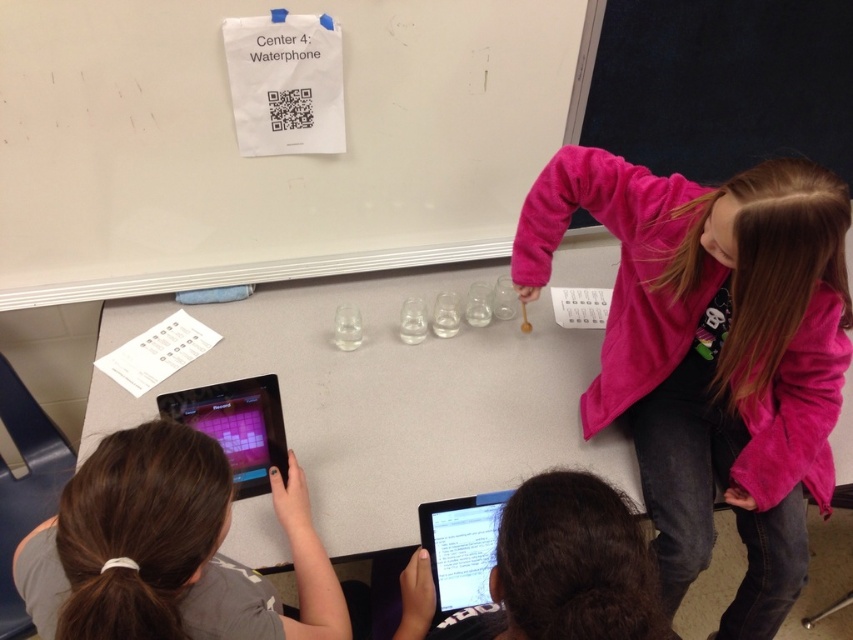
Does point (674, 442) lie behind point (163, 586)?

Yes, it is behind point (163, 586).

Does point (778, 552) come closer to viewer compared to point (80, 586)?

No, it is behind (80, 586).

Does point (653, 310) come closer to viewer compared to point (83, 596)?

No, it is behind (83, 596).

Where is `pink fleece jacket at upper right`? pink fleece jacket at upper right is located at coordinates (712, 353).

Based on the photo, can you confirm if pink fleece jacket at upper right is positioned to the right of black glossy tablet at lower center?

Yes, pink fleece jacket at upper right is to the right of black glossy tablet at lower center.

Can you confirm if pink fleece jacket at upper right is smaller than black glossy tablet at lower center?

Actually, pink fleece jacket at upper right might be larger than black glossy tablet at lower center.

Who is more forward, (688, 196) or (485, 582)?

Point (485, 582) is in front.

Where is `pink fleece jacket at upper right`? pink fleece jacket at upper right is located at coordinates (712, 353).

Which is above, pink fleece jacket at upper right or black glossy tablet at lower left?

black glossy tablet at lower left

Is point (590, 164) positioned behind point (265, 474)?

That is True.

Find the location of a particular element. pink fleece jacket at upper right is located at coordinates (712, 353).